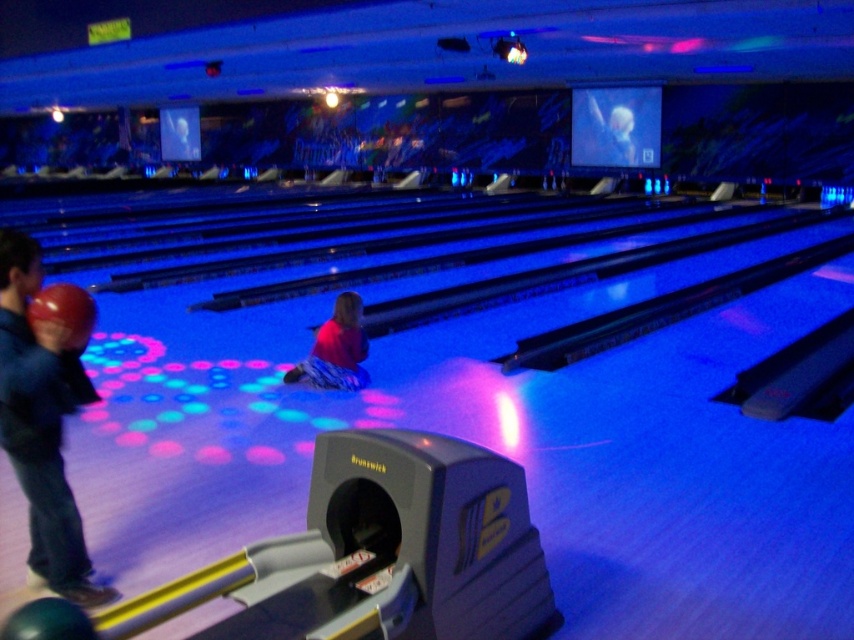
Question: Is blue denim jeans at lower left bigger than matte pink shirt at center?

Choices:
 (A) no
 (B) yes

Answer: (B)

Question: Is blue denim jeans at lower left bigger than matte pink shirt at center?

Choices:
 (A) no
 (B) yes

Answer: (B)

Question: Is blue denim jeans at lower left further to camera compared to matte pink shirt at center?

Choices:
 (A) no
 (B) yes

Answer: (A)

Question: Which of the following is the closest to the observer?

Choices:
 (A) blue denim jeans at lower left
 (B) matte pink shirt at center

Answer: (A)